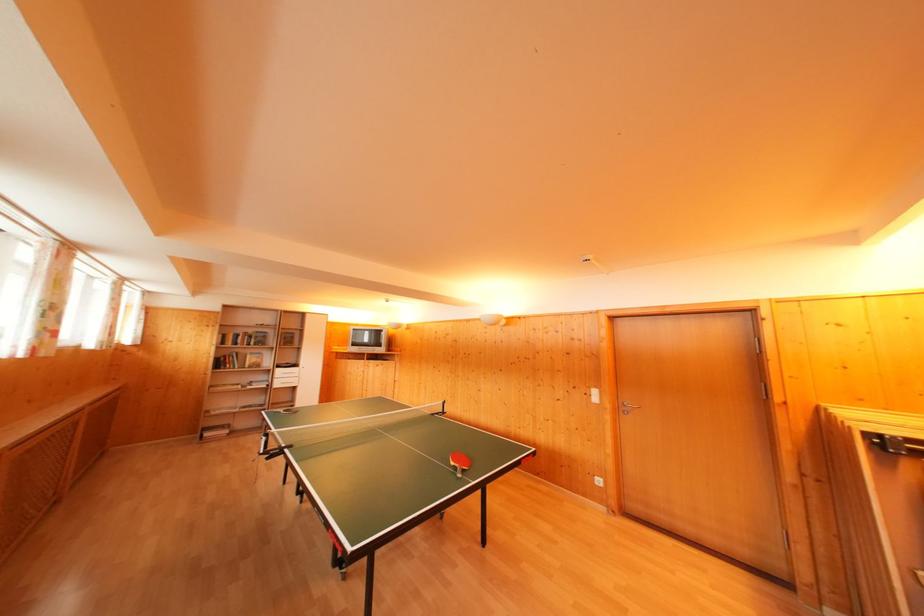
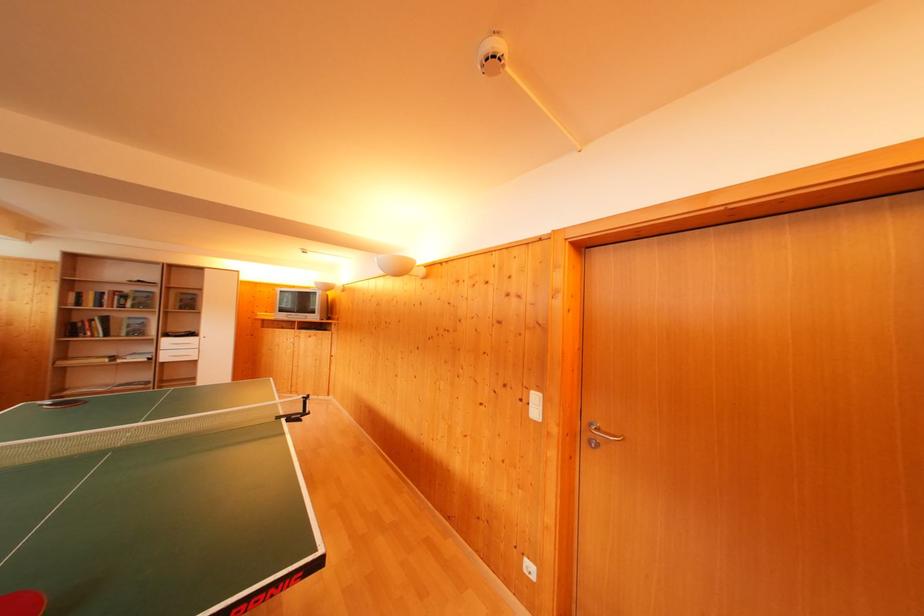
In the second image, find the point that corresponds to [260,365] in the first image.

(140, 331)